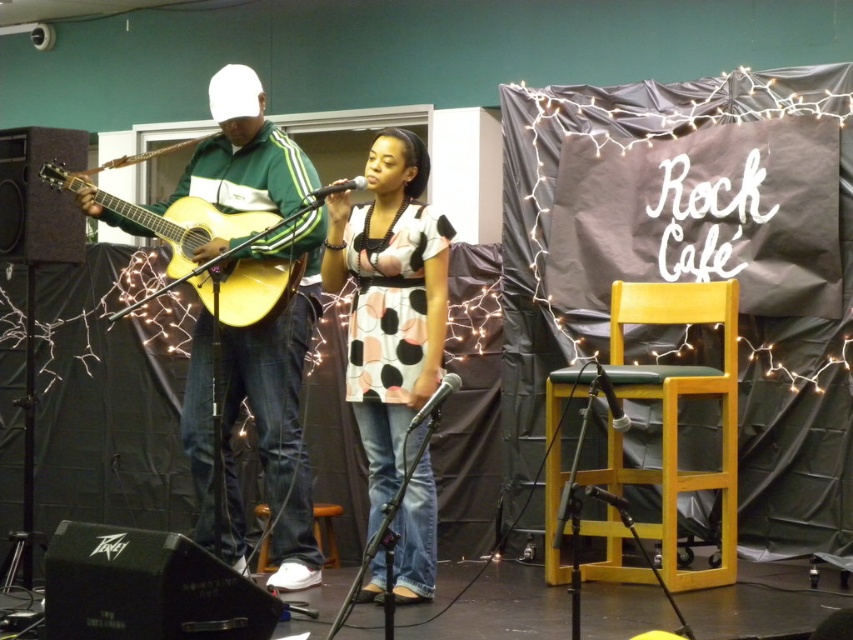
You are a photographer setting up for the live performance. You need to adjust the camera focus so that both the polka dot fabric dress at center and the acoustic wood guitar at left are in frame. Given that the dress is taller than the guitar, which object should you ensure is in focus first to capture both effectively?

The polka dot fabric dress at center is taller than the acoustic wood guitar at left, so you should focus on the dress first to ensure both are in frame.

You are a photographer at the Rock Cafe performance. You want to capture a closeup shot of the acoustic wood guitar at left and the polka dot fabric dress at center in the same frame. The camera you are using has a maximum focus range of 20 inches. Can you fit both subjects in focus without moving the camera?

The polka dot fabric dress at center and acoustic wood guitar at left are 23.39 inches apart. Since the distance between them exceeds the camera maximum focus range of 20 inches, you cannot fit both subjects in focus without moving the camera.

You are a photographer at the Rock Cafe performance. You need to position a spotlight on the polka dot fabric dress at center and the acoustic wood guitar at left. Based on their positions, which object should you aim the spotlight towards first if you want to light the performer closer to the audience?

The polka dot fabric dress at center is to the right of the acoustic wood guitar at left, so the acoustic wood guitar at left is closer to the audience. Therefore, you should aim the spotlight towards the acoustic wood guitar at left first.